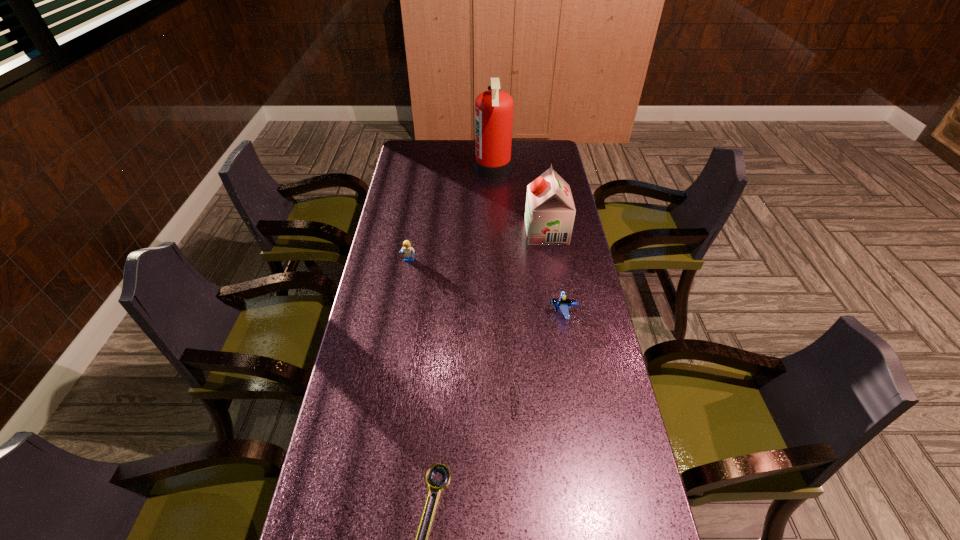
Locate an element on the screen. Image resolution: width=960 pixels, height=540 pixels. vacant space at the far right corner of the desktop is located at coordinates (545, 159).

Identify the location of vacant space that is in between the fire extinguisher and the soya milk. This screenshot has height=540, width=960. (519, 200).

This screenshot has height=540, width=960. Identify the location of free space between the sunglasses and the farthest object. (515, 285).

Image resolution: width=960 pixels, height=540 pixels. What are the coordinates of `unoccupied area between the shorter Lego and the sunglasses` in the screenshot? It's located at (549, 357).

The image size is (960, 540). Identify the location of free space between the farthest object and the second tallest object. (519, 200).

Identify the location of free spot between the fifth farthest object and the second tallest object. The width and height of the screenshot is (960, 540). (541, 317).

Identify which object is the third closest to the right Lego. Please provide its 2D coordinates. Your answer should be formatted as a tuple, i.e. [(x, y)], where the tuple contains the x and y coordinates of a point satisfying the conditions above.

[(408, 250)]

Locate which object is the fifth closest to the fire extinguisher. Please provide its 2D coordinates. Your answer should be formatted as a tuple, i.e. [(x, y)], where the tuple contains the x and y coordinates of a point satisfying the conditions above.

[(436, 468)]

This screenshot has width=960, height=540. What are the coordinates of `free point that satisfies the following two spatial constraints: 1. with the cap open on the fifth nearest object; 2. on the front-facing side of the farther Lego` in the screenshot? It's located at (551, 260).

Locate an element on the screen. The width and height of the screenshot is (960, 540). vacant space that satisfies the following two spatial constraints: 1. with the cap open on the soya milk; 2. on the front-facing side of the third tallest object is located at coordinates (551, 260).